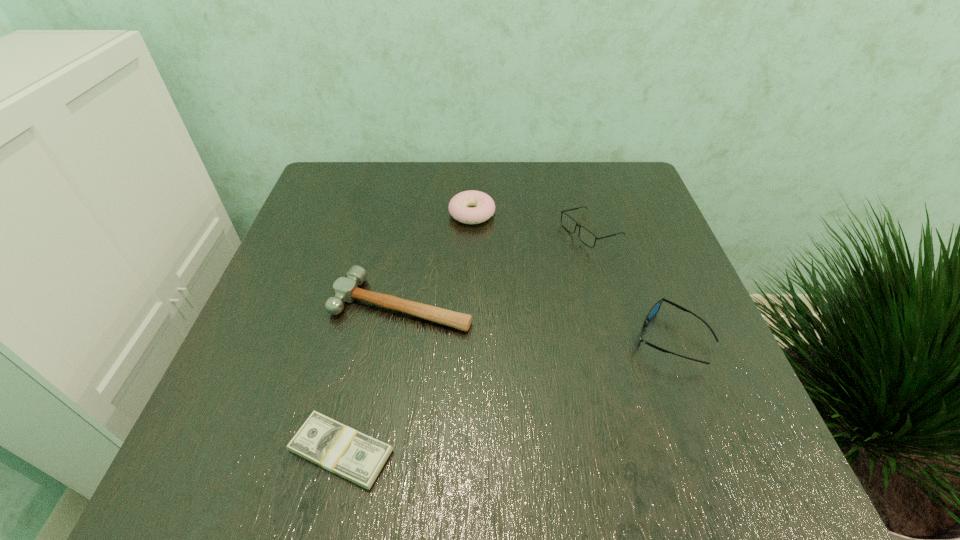
Identify the location of vacant region located on the back of the hammer. This screenshot has width=960, height=540. (421, 185).

Locate an element on the screen. This screenshot has height=540, width=960. free space located at the front of the sunglasses showing the lenses is located at coordinates (588, 339).

You are a GUI agent. You are given a task and a screenshot of the screen. Output one action in this format:
    pyautogui.click(x=<x>, y=<y>)
    Task: Click on the blank area located at the front of the sunglasses showing the lenses
    
    Given the screenshot: What is the action you would take?
    pyautogui.click(x=412, y=339)

Locate an element on the screen. free spot located at the front of the sunglasses showing the lenses is located at coordinates (472, 339).

Find the location of a particular element. The height and width of the screenshot is (540, 960). blank space located on the back of the shortest object is located at coordinates point(377,291).

Locate an element on the screen. spectacles present at the far edge is located at coordinates click(586, 236).

Where is `doughnut located at the far edge`? The height and width of the screenshot is (540, 960). doughnut located at the far edge is located at coordinates (459, 206).

Identify the location of object at the near edge. (342, 450).

The height and width of the screenshot is (540, 960). I want to click on hammer that is at the left edge, so click(x=345, y=289).

You are a GUI agent. You are given a task and a screenshot of the screen. Output one action in this format:
    pyautogui.click(x=<x>, y=<y>)
    Task: Click on the dollar situated at the left edge
    The image size is (960, 540).
    Given the screenshot: What is the action you would take?
    pyautogui.click(x=342, y=450)